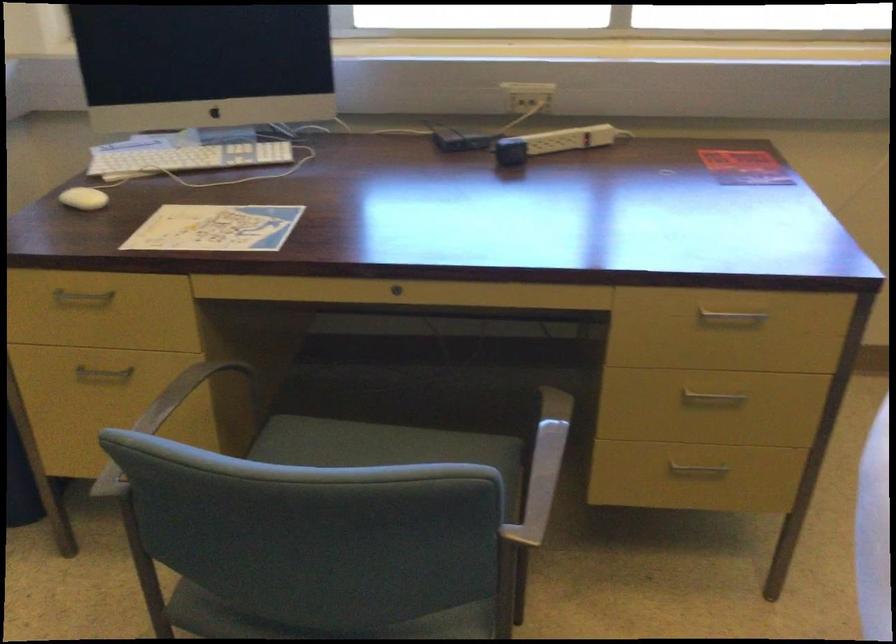
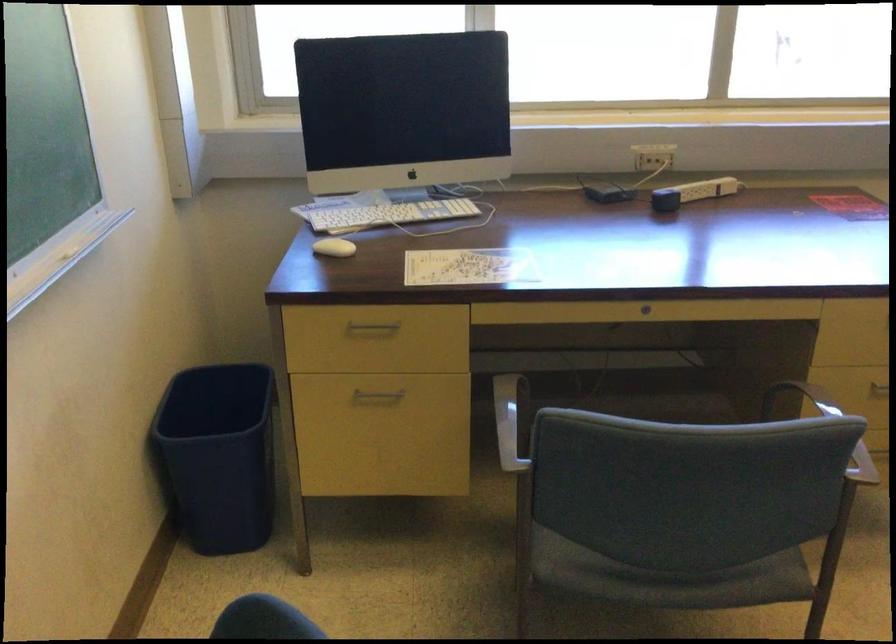
The point at (506, 156) is marked in the first image. Where is the corresponding point in the second image?

(665, 200)